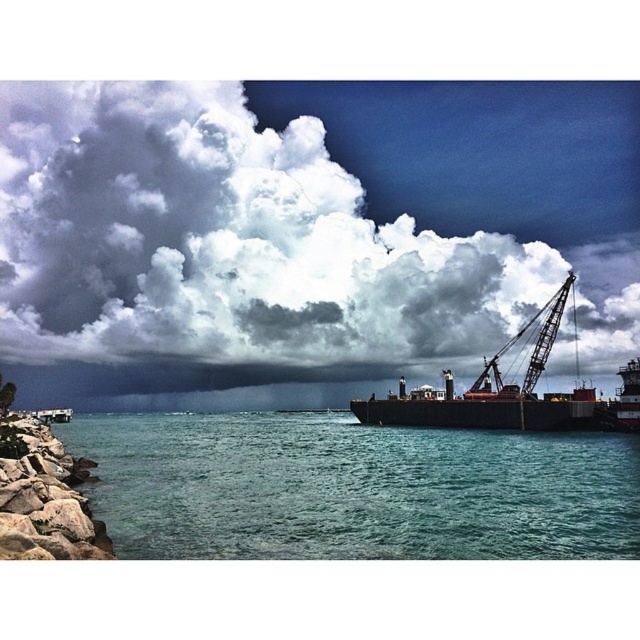
In the scene shown: Is white fluffy cloud at upper center bigger than metallic gray crane at right?

Indeed, white fluffy cloud at upper center has a larger size compared to metallic gray crane at right.

Which is in front, point (161, 90) or point (477, 381)?

Point (477, 381) is in front.

Who is more forward, (353, 186) or (548, 348)?

Point (548, 348)

This screenshot has height=640, width=640. In order to click on white fluffy cloud at upper center in this screenshot , I will do `click(308, 221)`.

Who is more forward, (365,401) or (536,365)?

Point (536,365) is in front.

Does dark brown metal ship at right appear on the right side of metallic gray crane at right?

Incorrect, dark brown metal ship at right is not on the right side of metallic gray crane at right.

This screenshot has height=640, width=640. What do you see at coordinates (496, 394) in the screenshot?
I see `dark brown metal ship at right` at bounding box center [496, 394].

You are a GUI agent. You are given a task and a screenshot of the screen. Output one action in this format:
    pyautogui.click(x=<x>, y=<y>)
    Task: Click on the dark brown metal ship at right
    This screenshot has height=640, width=640.
    Given the screenshot: What is the action you would take?
    pyautogui.click(x=496, y=394)

Which is in front, point (625, 536) or point (460, 410)?

Positioned in front is point (625, 536).

Can you confirm if teal glossy water at lower center is taller than dark brown metal ship at right?

Incorrect, teal glossy water at lower center's height is not larger of dark brown metal ship at right's.

Image resolution: width=640 pixels, height=640 pixels. Identify the location of teal glossy water at lower center. (355, 488).